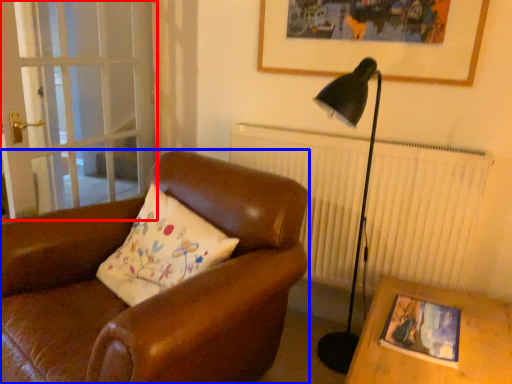
Question: Which object is further to the camera taking this photo, screen door (highlighted by a red box) or chair (highlighted by a blue box)?

Choices:
 (A) screen door
 (B) chair

Answer: (A)